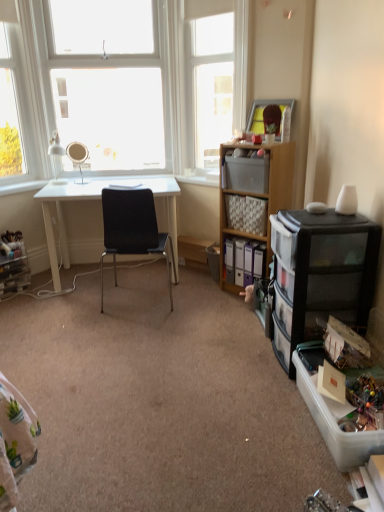
You are a GUI agent. You are given a task and a screenshot of the screen. Output one action in this format:
    pyautogui.click(x=<x>, y=<y>)
    Task: Click on the vacant area that is in front of white glossy desk at center
    
    Given the screenshot: What is the action you would take?
    pyautogui.click(x=93, y=324)